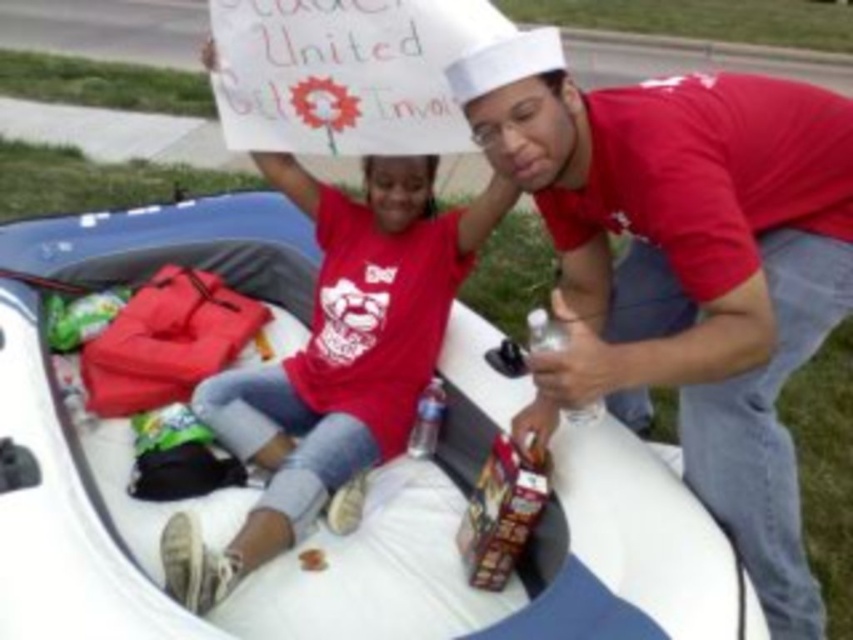
You are a photographer trying to capture a photo of the white rubber boat at center from a distance of 10 feet. If you want to ensure both individuals inside the boat are clearly visible in your photo, is the distance sufficient?

The two individuals are 6.06 feet apart. Since the photographer is 10 feet away from the boat, the distance is sufficient to capture both individuals clearly in the photo.

You are a photographer at a community event. You need to position your camera at point A to capture the white rubber boat at center. What coordinate should you aim for?

The white rubber boat at center is located at coordinate point (97, 516).